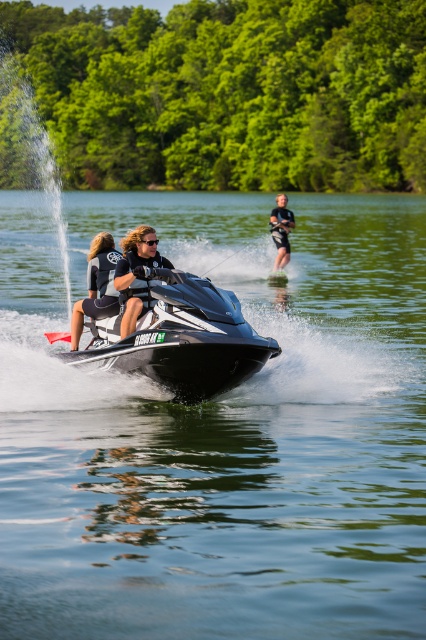
You are a safety inspector checking the jet ski and life vest positions. According to the image, is the shiny black jet ski at center located below the matte black life vest at center?

Yes, the shiny black jet ski at center is positioned under the matte black life vest at center, so it is located below it.

You are a safety inspector reviewing the jet ski setup in the image. You notice two jet skis labeled as shiny black jet ski at center and matte black jet ski at center. According to safety regulations, the taller jet ski must have a higher railing for passenger safety. Which jet ski requires the safety railing upgrade?

The shiny black jet ski at center requires the safety railing upgrade because it is much taller than the matte black jet ski at center, necessitating a higher railing for passenger safety.

You are a safety inspector checking the safety distance between the shiny black jet ski at center and the matte black life vest at center. According to regulations, the minimum safe distance between any two objects on a jet ski should be at least 1.5 meters. Is the current distance compliant?

The shiny black jet ski at center is 1.26 meters from the matte black life vest at center. Since 1.26 meters is less than the required 1.5 meters, the current distance does not comply with safety regulations.